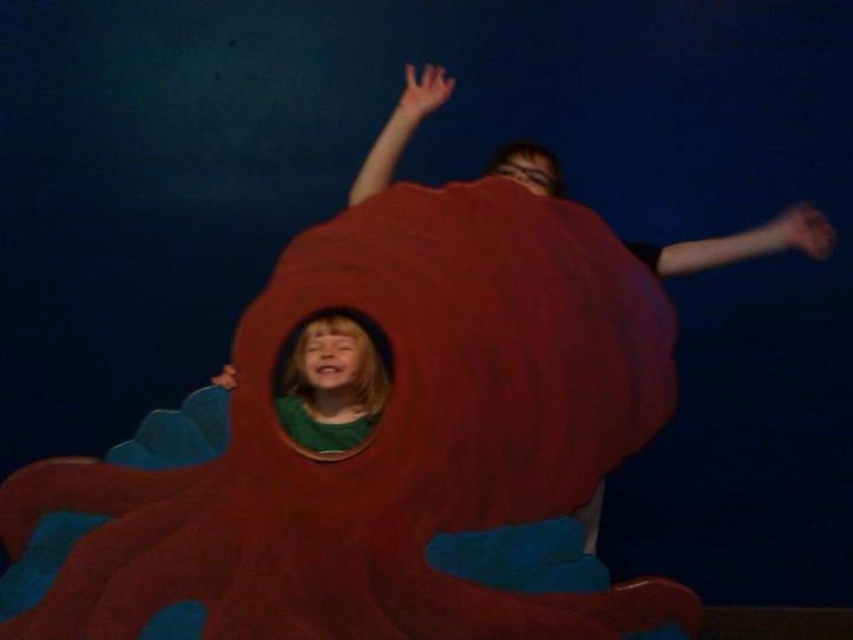
Is matte red octopus at center bigger than matte green shirt at center?

Indeed, matte red octopus at center has a larger size compared to matte green shirt at center.

Which is above, matte red octopus at center or matte green shirt at center?

Positioned higher is matte green shirt at center.

What do you see at coordinates (379, 449) in the screenshot? This screenshot has height=640, width=853. I see `matte red octopus at center` at bounding box center [379, 449].

Locate an element on the screen. matte red octopus at center is located at coordinates (379, 449).